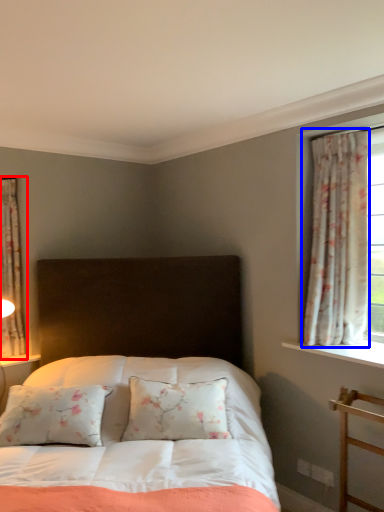
Question: Which object appears farthest to the camera in this image, curtain (highlighted by a red box) or curtain (highlighted by a blue box)?

Choices:
 (A) curtain
 (B) curtain

Answer: (A)